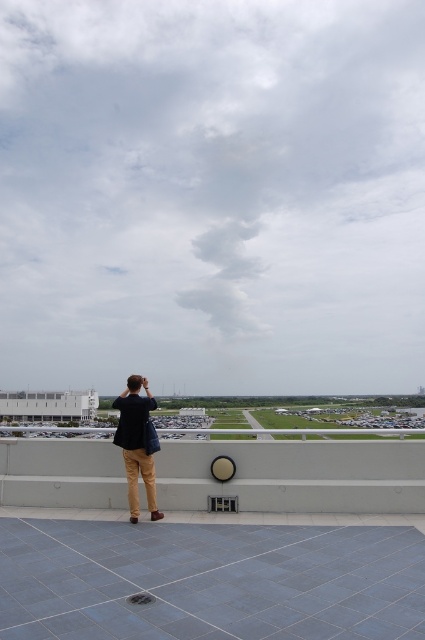
Question: Can you confirm if gray concrete ledge at lower center is positioned above dark blue shirt at center?

Choices:
 (A) yes
 (B) no

Answer: (B)

Question: In this image, where is gray concrete ledge at lower center located relative to dark blue shirt at center?

Choices:
 (A) above
 (B) below

Answer: (B)

Question: Which of the following is the farthest from the observer?

Choices:
 (A) (116, 444)
 (B) (243, 444)

Answer: (B)

Question: Which object is farther from the camera taking this photo?

Choices:
 (A) dark blue shirt at center
 (B) gray concrete ledge at lower center

Answer: (B)

Question: Can you confirm if gray concrete ledge at lower center is thinner than dark blue shirt at center?

Choices:
 (A) yes
 (B) no

Answer: (B)